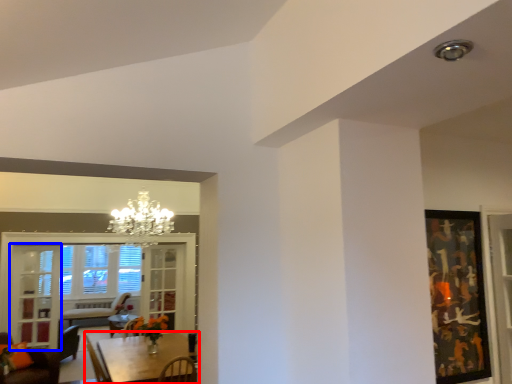
Question: Which object is further to the camera taking this photo, table (highlighted by a red box) or glass door (highlighted by a blue box)?

Choices:
 (A) table
 (B) glass door

Answer: (B)